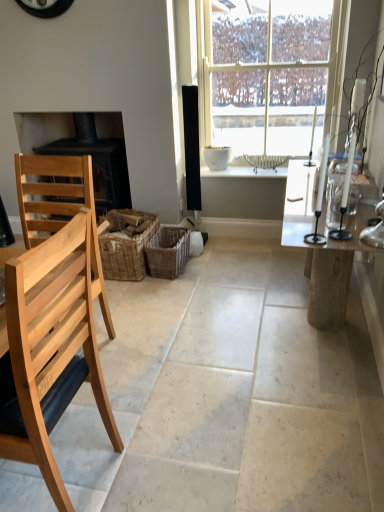
Identify the location of white wicker basket at center. This screenshot has height=512, width=384. (265, 161).

Describe the element at coordinates (268, 73) in the screenshot. This screenshot has width=384, height=512. I see `white glass window at center` at that location.

I want to click on black matte fireplace at left, so (83, 148).

Identify the location of natural wood chair at left, arranged as the 2th chair when viewed from the front. (60, 208).

Describe the element at coordinates (321, 250) in the screenshot. This screenshot has height=512, width=384. I see `clear glass table at right` at that location.

This screenshot has width=384, height=512. I want to click on woven brown basket at center, the 1th crate positioned from the right, so click(x=167, y=252).

Is black matte fireplace at left looking in the opposite direction of natural wood chair at left, placed as the first chair when sorted from back to front?

No, black matte fireplace at left is not facing the opposite direction of natural wood chair at left, placed as the first chair when sorted from back to front.

From the image's perspective, is black matte fireplace at left above natural wood chair at left, placed as the first chair when sorted from back to front?

Yes.

Is natural wood chair at left, placed as the first chair when sorted from back to front, surrounded by black matte fireplace at left?

Actually, natural wood chair at left, placed as the first chair when sorted from back to front, is outside black matte fireplace at left.

From a real-world perspective, is black matte fireplace at left beneath natural wood chair at left, arranged as the 2th chair when viewed from the front?

No.

Is white glass window at center inside or outside of black matte fireplace at left?

white glass window at center lies outside black matte fireplace at left.

From the image's perspective, which object appears higher, white glass window at center or black matte fireplace at left?

From the image's view, white glass window at center is above.

Does white glass window at center touch black matte fireplace at left?

No.

From the image's perspective, is clear glass table at right located beneath white glass window at center?

Yes, from the image's perspective, clear glass table at right is beneath white glass window at center.

Considering the sizes of objects clear glass table at right and white glass window at center in the image provided, who is bigger, clear glass table at right or white glass window at center?

clear glass table at right is bigger.

Is point (305, 187) less distant than point (243, 86)?

Yes, point (305, 187) is closer to viewer.

Does clear glass table at right turn towards white glass window at center?

No.

The width and height of the screenshot is (384, 512). What are the coordinates of `the 1st chair below when counting from the woven brown basket at center, which appears as the 2th crate when viewed from the right (from the image's perspective)` in the screenshot? It's located at (60, 208).

Is woven brown basket at center, which ranks as the 1th crate in left-to-right order, located within natural wood chair at left, placed as the first chair when sorted from back to front?

No, woven brown basket at center, which ranks as the 1th crate in left-to-right order, is not a part of natural wood chair at left, placed as the first chair when sorted from back to front.

From the image's perspective, is natural wood chair at left, arranged as the 2th chair when viewed from the front, over woven brown basket at center, which ranks as the 1th crate in left-to-right order?

No.

From a real-world perspective, which is physically below, woven brown basket at center, arranged as the 2th crate when viewed from the left, or white glass window at center?

In real-world perspective, woven brown basket at center, arranged as the 2th crate when viewed from the left, is lower.

Considering the sizes of objects woven brown basket at center, arranged as the 2th crate when viewed from the left, and white glass window at center in the image provided, who is smaller, woven brown basket at center, arranged as the 2th crate when viewed from the left, or white glass window at center?

Smaller between the two is woven brown basket at center, arranged as the 2th crate when viewed from the left.

Considering the sizes of objects woven brown basket at center, arranged as the 2th crate when viewed from the left, and white glass window at center in the image provided, who is shorter, woven brown basket at center, arranged as the 2th crate when viewed from the left, or white glass window at center?

woven brown basket at center, arranged as the 2th crate when viewed from the left.

How different are the orientations of woven brown basket at center, arranged as the 2th crate when viewed from the left, and white glass window at center in degrees?

The angular difference between woven brown basket at center, arranged as the 2th crate when viewed from the left, and white glass window at center is 2.3 degrees.

Is clear glass table at right inside the boundaries of black matte fireplace at left, or outside?

clear glass table at right lies outside black matte fireplace at left.

Considering the sizes of objects clear glass table at right and black matte fireplace at left in the image provided, who is taller, clear glass table at right or black matte fireplace at left?

black matte fireplace at left.

Consider the image. Considering the sizes of objects clear glass table at right and natural wood chair at left, arranged as the 2th chair when viewed from the front, in the image provided, who is thinner, clear glass table at right or natural wood chair at left, arranged as the 2th chair when viewed from the front,?

clear glass table at right.

Where is `table on the right of natural wood chair at left, placed as the first chair when sorted from back to front`? Image resolution: width=384 pixels, height=512 pixels. table on the right of natural wood chair at left, placed as the first chair when sorted from back to front is located at coordinates (321, 250).

Would you say clear glass table at right is inside or outside natural wood chair at left, placed as the first chair when sorted from back to front?

clear glass table at right is outside natural wood chair at left, placed as the first chair when sorted from back to front.

Considering the sizes of clear glass table at right and natural wood chair at left, placed as the first chair when sorted from back to front, in the image, is clear glass table at right bigger or smaller than natural wood chair at left, placed as the first chair when sorted from back to front,?

clear glass table at right is bigger than natural wood chair at left, placed as the first chair when sorted from back to front.

What are the coordinates of `the 1st chair to the right when counting from the black matte fireplace at left` in the screenshot? It's located at (60, 208).

You are a GUI agent. You are given a task and a screenshot of the screen. Output one action in this format:
    pyautogui.click(x=<x>, y=<y>)
    Task: Click on the fireplace below the white glass window at center (from a real-world perspective)
    This screenshot has width=384, height=512.
    Given the screenshot: What is the action you would take?
    pyautogui.click(x=83, y=148)

When comparing their distances from natural wood chair at left, arranged as the 2th chair when viewed from the front, does woven brown basket at center, which appears as the 2th crate when viewed from the right, or white glass window at center seem closer?

woven brown basket at center, which appears as the 2th crate when viewed from the right, is closer to natural wood chair at left, arranged as the 2th chair when viewed from the front.

When comparing their distances from clear glass table at right, does white wicker basket at center or black matte fireplace at left seem closer?

white wicker basket at center is closer to clear glass table at right.

When comparing their distances from clear glass table at right, does white glass window at center or natural wood chair at left, placed as the first chair when sorted from back to front, seem closer?

The object closer to clear glass table at right is white glass window at center.

When comparing their distances from white wicker basket at center, does natural wood chair at left, arranged as the 2th chair when viewed from the front, or woven brown basket at center, which ranks as the 1th crate in left-to-right order, seem closer?

Among the two, woven brown basket at center, which ranks as the 1th crate in left-to-right order, is located nearer to white wicker basket at center.

Which object lies nearer to the anchor point white glass window at center, black matte fireplace at left or woven brown basket at center, arranged as the 2th crate when viewed from the left?

black matte fireplace at left.

Based on their spatial positions, is clear glass table at right or woven brown basket at center, which ranks as the 1th crate in left-to-right order, further from white glass window at center?

The object further to white glass window at center is woven brown basket at center, which ranks as the 1th crate in left-to-right order.

Looking at the image, which one is located further to white wicker basket at center, clear glass table at right or natural wood chair at left, arranged as the 2th chair when viewed from the front?

natural wood chair at left, arranged as the 2th chair when viewed from the front, is positioned further to the anchor white wicker basket at center.

Which object lies further to the anchor point white wicker basket at center, natural wood chair at left, the first chair when ordered from front to back, or woven brown basket at center, the 1th crate positioned from the right?

Based on the image, natural wood chair at left, the first chair when ordered from front to back, appears to be further to white wicker basket at center.

This screenshot has height=512, width=384. What are the coordinates of `window between black matte fireplace at left and white wicker basket at center in the horizontal direction` in the screenshot? It's located at (268, 73).

Where is `table between natural wood chair at left, acting as the second chair starting from the back, and woven brown basket at center, the 1th crate positioned from the right, along the z-axis`? table between natural wood chair at left, acting as the second chair starting from the back, and woven brown basket at center, the 1th crate positioned from the right, along the z-axis is located at coordinates (321, 250).

Identify the location of window between natural wood chair at left, placed as the first chair when sorted from back to front, and white wicker basket at center from front to back. This screenshot has height=512, width=384. (268, 73).

Where is `window located between clear glass table at right and white wicker basket at center in the depth direction`? Image resolution: width=384 pixels, height=512 pixels. window located between clear glass table at right and white wicker basket at center in the depth direction is located at coordinates (268, 73).